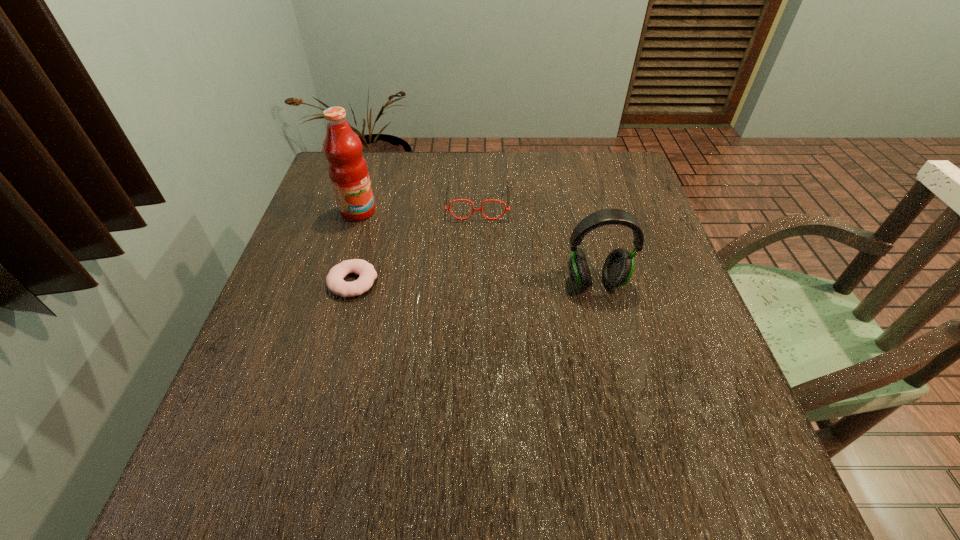
This screenshot has width=960, height=540. Find the location of `free space that is in between the fruit juice and the doughnut`. free space that is in between the fruit juice and the doughnut is located at coordinates (355, 247).

The image size is (960, 540). What are the coordinates of `free space that is in between the third tallest object and the third shortest object` in the screenshot? It's located at (537, 241).

Find the location of a particular element. This screenshot has height=540, width=960. blank region between the second tallest object and the spectacles is located at coordinates (537, 241).

Identify the location of free space between the fruit juice and the headset. Image resolution: width=960 pixels, height=540 pixels. (477, 246).

At what (x,y) coordinates should I click in order to perform the action: click on the third closest object to the second tallest object. Please return your answer as a coordinate pair (x, y). This screenshot has width=960, height=540. Looking at the image, I should click on (347, 168).

You are a GUI agent. You are given a task and a screenshot of the screen. Output one action in this format:
    pyautogui.click(x=<x>, y=<y>)
    Task: Click on the object that is the third closest one to the shortest object
    
    Given the screenshot: What is the action you would take?
    pyautogui.click(x=618, y=267)